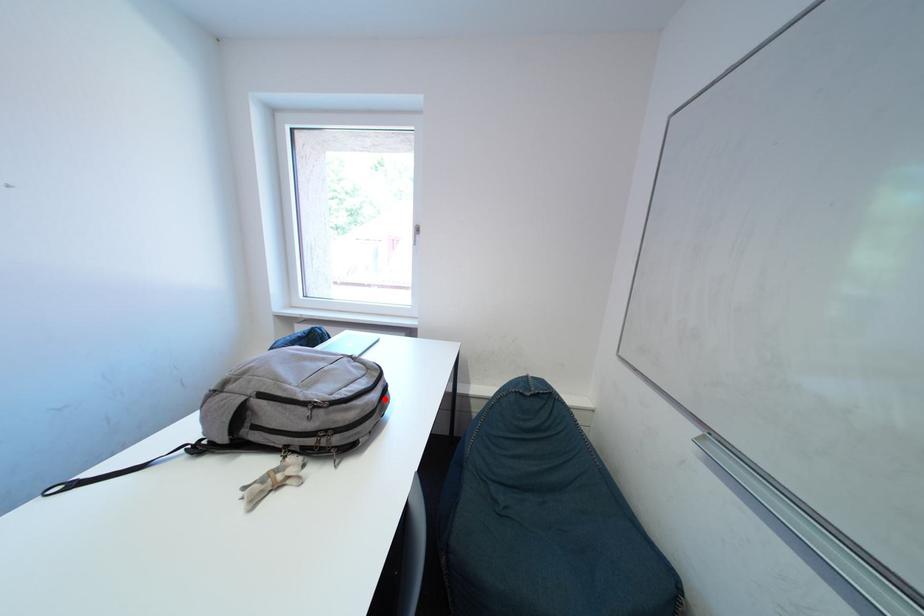
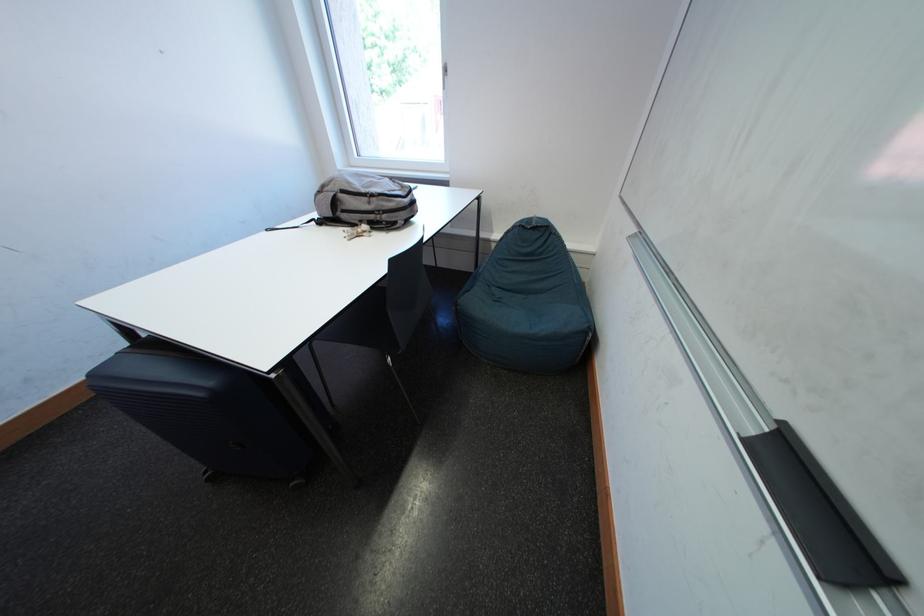
The point at the highlighted location is marked in the first image. Where is the corresponding point in the second image?

(416, 204)